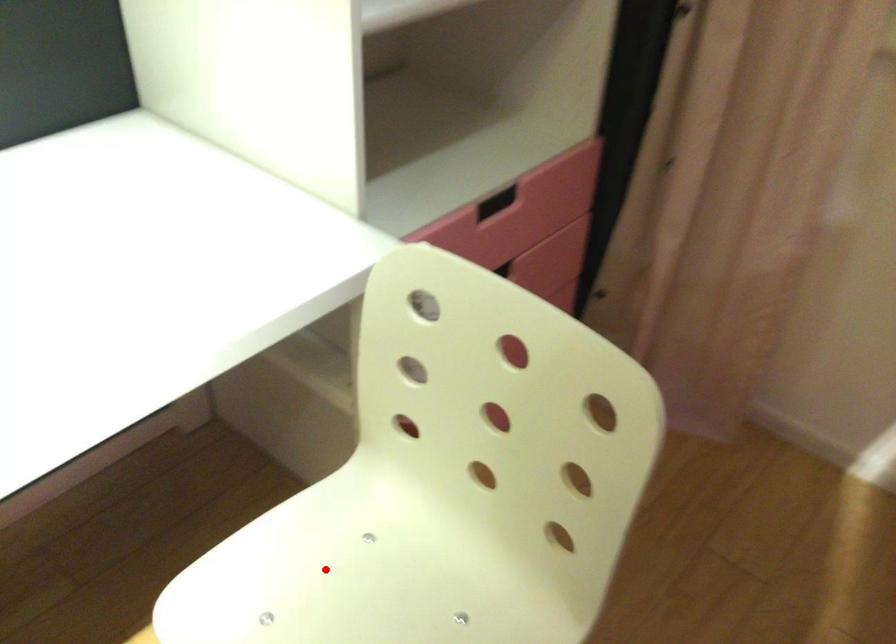
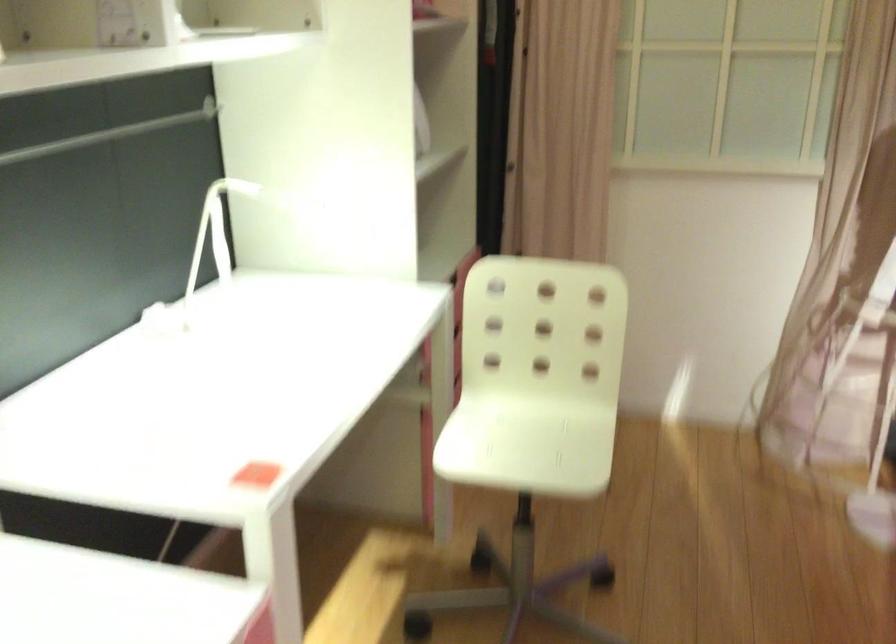
Find the pixel in the second image that matches the highlighted location in the first image.

(495, 431)